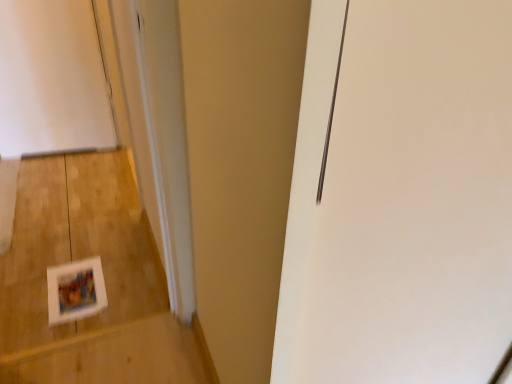
This screenshot has width=512, height=384. In order to click on empty space that is ontop of matte white postcard at lower left (from a real-world perspective) in this screenshot , I will do `click(76, 281)`.